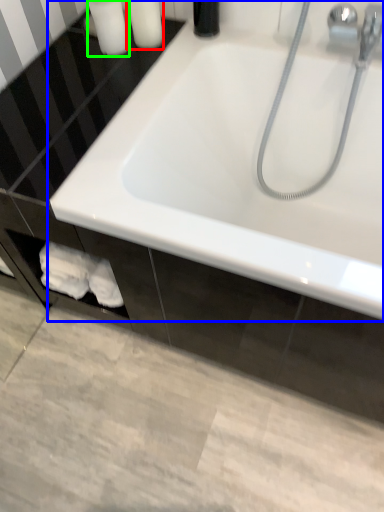
Question: Which object is the closest to the toiletry (highlighted by a red box)? Choose among these: bathtub (highlighted by a blue box) or toiletry (highlighted by a green box).

Choices:
 (A) bathtub
 (B) toiletry

Answer: (B)